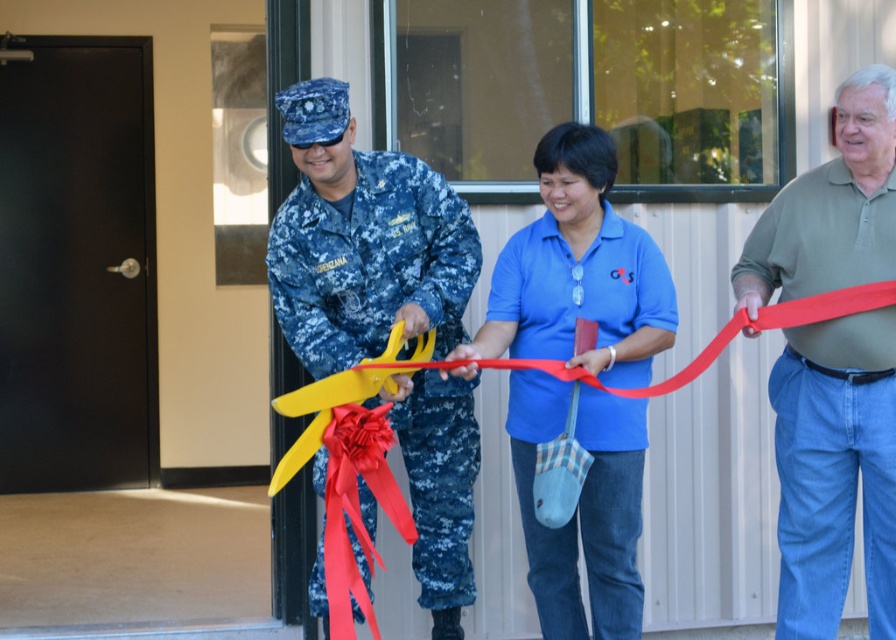
Based on the scene description, where is the digital camouflage uniform at center located in the image?

The digital camouflage uniform at center is located at point coordinates of (369, 260).

You are a photographer at the ribbon cutting ceremony. You want to take a photo that includes both the digital camouflage uniform at center and the silky red ribbon at center. What is the minimum distance you need to step back to ensure both are in frame?

The minimum distance you need to step back to ensure both the digital camouflage uniform at center and the silky red ribbon at center are in frame is 19.67 inches.

During the ribbon cutting ceremony, where is the yellow matte scissors at center located relative to the silky red ribbon at center?

The yellow matte scissors at center are to the right of the silky red ribbon at center.